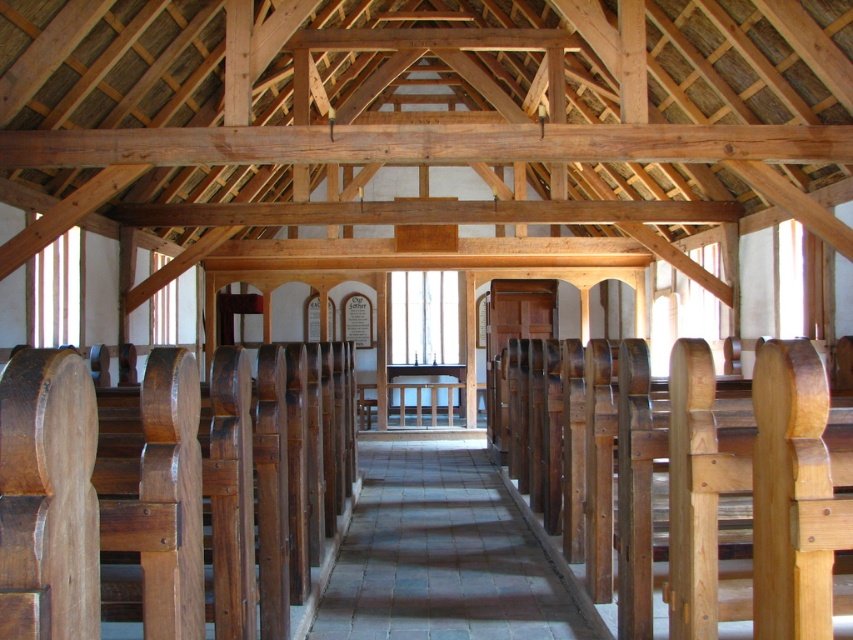
In the scene shown: You are standing at the entrance of the church and want to sit down. Which object, the natural wood church bench at center or the gray stone aisle at center, is closer to you?

The natural wood church bench at center is closer to the viewer than the gray stone aisle at center, so you should sit on the natural wood church bench at center.

You are standing in the center of the church and want to sit down. Which object at point (740, 483) should you approach?

The point (740, 483) corresponds to the natural wood church bench at center, so you should approach the natural wood church bench at center.

You are standing at the entrance of the church and want to sit down. You see the natural wood church bench at center and the gray stone aisle at center. Which one is located to the right side of the other?

The natural wood church bench at center is to the right of the gray stone aisle at center.